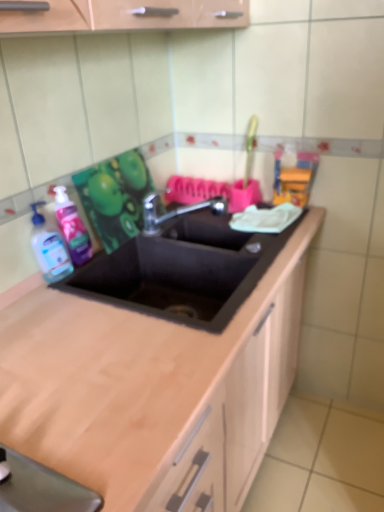
Question: Is transparent plastic bottle at left in front of or behind translucent plastic soap dispenser at left in the image?

Choices:
 (A) behind
 (B) front

Answer: (B)

Question: From the image's perspective, is transparent plastic bottle at left positioned above or below translucent plastic soap dispenser at left?

Choices:
 (A) below
 (B) above

Answer: (A)

Question: Which of these objects is positioned farthest from the metallic faucet at center?

Choices:
 (A) transparent plastic bottle at left
 (B) black matte sink at center
 (C) translucent plastic soap dispenser at left

Answer: (A)

Question: Estimate the real-world distances between objects in this image. Which object is closer to the transparent plastic bottle at left?

Choices:
 (A) metallic faucet at center
 (B) translucent plastic soap dispenser at left
 (C) black matte sink at center

Answer: (B)